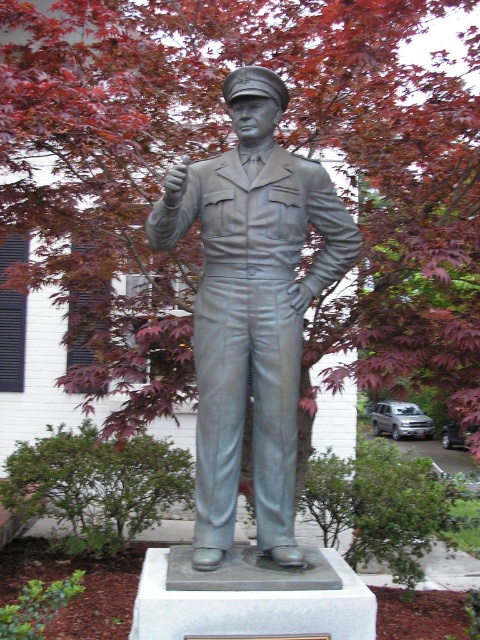
Question: Which object is farther from the camera taking this photo?

Choices:
 (A) bronze statue at center
 (B) reddish-brown leaves at upper center

Answer: (B)

Question: Is reddish-brown leaves at upper center to the right of bronze statue at center from the viewer's perspective?

Choices:
 (A) yes
 (B) no

Answer: (A)

Question: Does reddish-brown leaves at upper center come behind bronze statue at center?

Choices:
 (A) no
 (B) yes

Answer: (B)

Question: Does reddish-brown leaves at upper center have a larger size compared to bronze statue at center?

Choices:
 (A) yes
 (B) no

Answer: (A)

Question: Which point is farther to the camera?

Choices:
 (A) (230, 337)
 (B) (156, 90)

Answer: (B)

Question: Which point is closer to the camera?

Choices:
 (A) reddish-brown leaves at upper center
 (B) bronze statue at center

Answer: (B)